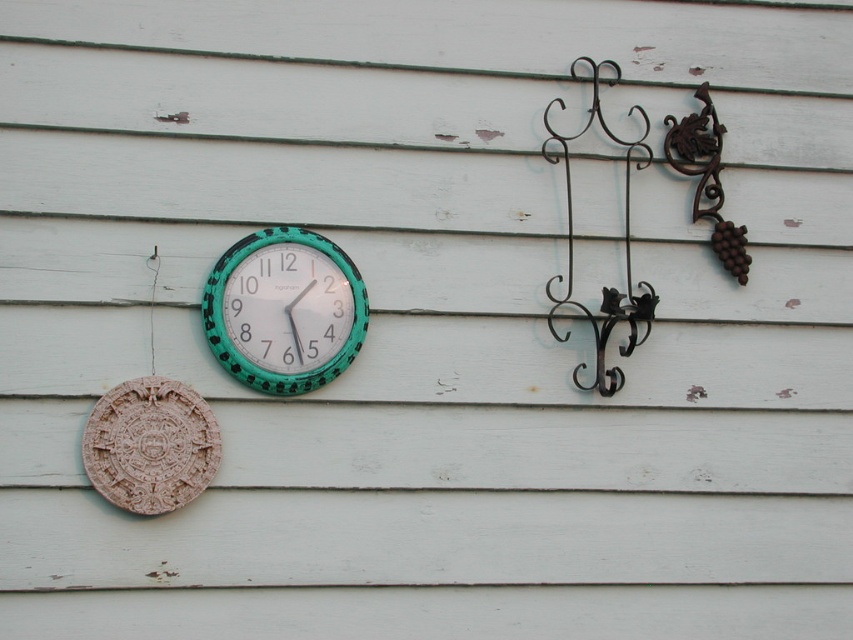
Looking at this image, you are hanging a new picture frame that needs to be centered between the carved stone plaque at lower left and the black wrought iron hook at upper right. Which object should you place the frame closer to in order to center it properly?

The carved stone plaque at lower left is to the left of the black wrought iron hook at upper right. To center the frame between them, you should place it closer to the carved stone plaque at lower left since it is positioned further left compared to the hook.

You are a painter standing in front of the light teal wall. You need to hang a new picture frame that requires a hook. The frame is heavy and you want to ensure the hook can support it. Which hook should you choose between the black wrought iron hook at upper right and the rusty wrought iron hook at upper right?

The black wrought iron hook at upper right is much taller than the rusty wrought iron hook at upper right, so it is likely stronger and can support the heavy picture frame better.